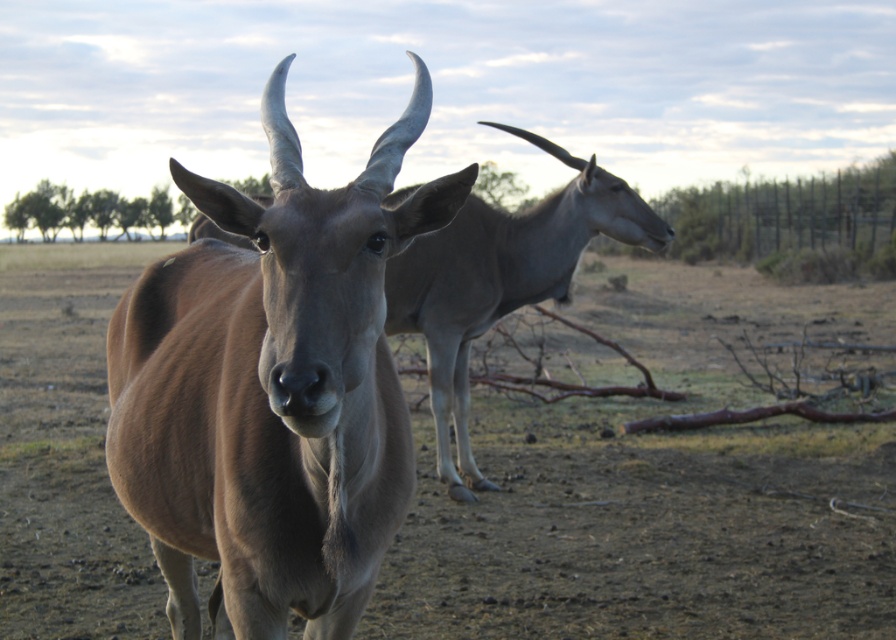
Question: Which point is farther to the camera?

Choices:
 (A) brown smooth antelope at center
 (B) brown matte antelope at center

Answer: (B)

Question: Does brown smooth antelope at center have a greater width compared to brown matte antelope at center?

Choices:
 (A) no
 (B) yes

Answer: (A)

Question: Which object appears farthest from the camera in this image?

Choices:
 (A) brown matte antelope at center
 (B) brown smooth antelope at center

Answer: (A)

Question: Considering the relative positions of brown smooth antelope at center and brown matte antelope at center in the image provided, where is brown smooth antelope at center located with respect to brown matte antelope at center?

Choices:
 (A) right
 (B) left

Answer: (B)

Question: Can you confirm if brown smooth antelope at center is bigger than brown matte antelope at center?

Choices:
 (A) yes
 (B) no

Answer: (B)